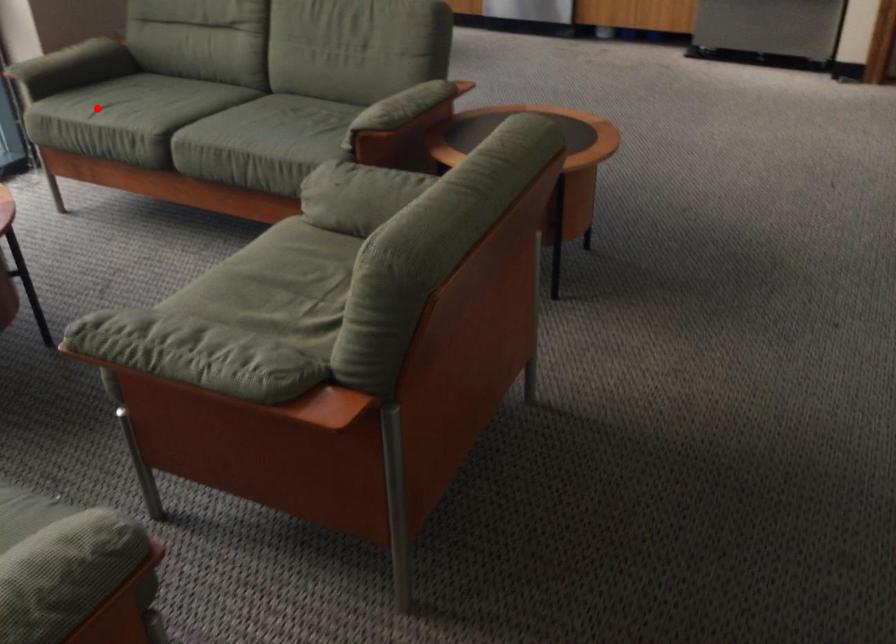
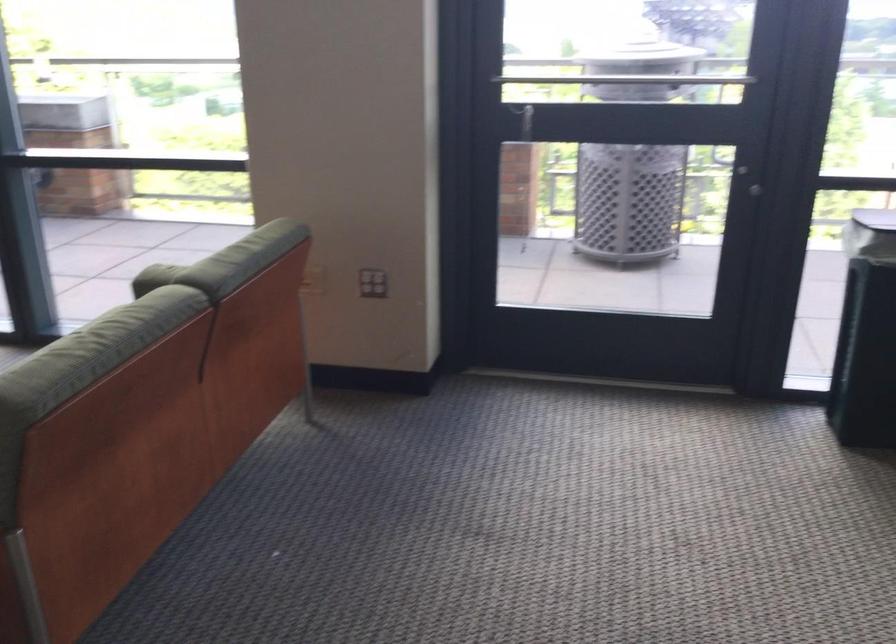
Question: I am providing you with two images of the same scene from different viewpoints. A red point is marked on the first image. Is the red point's position out of view in image 2?

Choices:
 (A) Yes
 (B) No

Answer: (A)